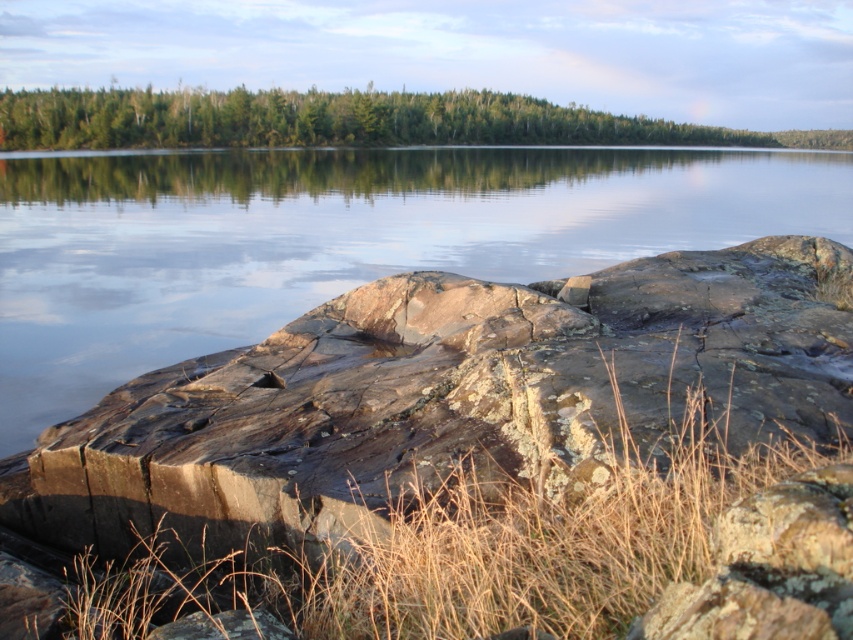
Can you confirm if clear water at center is positioned below green matte forest at upper center?

Correct, clear water at center is located below green matte forest at upper center.

What do you see at coordinates (335, 240) in the screenshot? The width and height of the screenshot is (853, 640). I see `clear water at center` at bounding box center [335, 240].

Image resolution: width=853 pixels, height=640 pixels. Find the location of `clear water at center`. clear water at center is located at coordinates (335, 240).